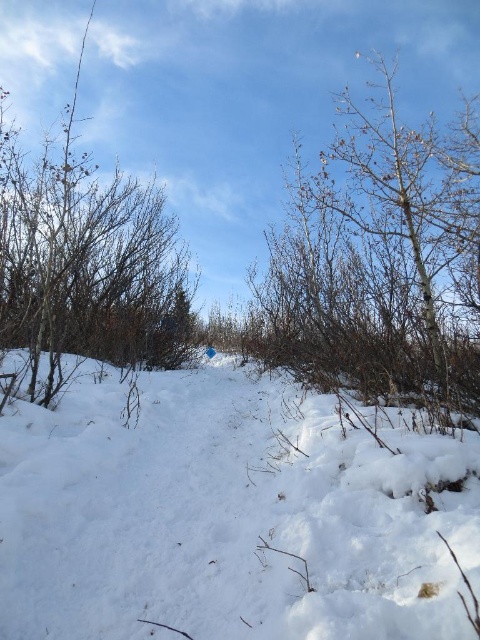
Can you confirm if white fluffy snow at center is positioned to the left of bare branches at upper right?

Indeed, white fluffy snow at center is positioned on the left side of bare branches at upper right.

Between white fluffy snow at center and bare branches at upper right, which one has more height?

Standing taller between the two is bare branches at upper right.

Who is more forward, (x=257, y=509) or (x=397, y=179)?

Point (x=257, y=509) is more forward.

This screenshot has width=480, height=640. What are the coordinates of `white fluffy snow at center` in the screenshot? It's located at (230, 513).

Which is below, bare branches at upper right or brown/dry wood at left?

brown/dry wood at left is below.

Is bare branches at upper right to the right of brown/dry wood at left from the viewer's perspective?

Correct, you'll find bare branches at upper right to the right of brown/dry wood at left.

Who is more distant from viewer, (313,336) or (61,208)?

The point (61,208) is more distant.

What are the coordinates of `bare branches at upper right` in the screenshot? It's located at (380, 260).

Can you confirm if white fluffy snow at center is smaller than brown/dry wood at left?

Yes.

Which of these two, white fluffy snow at center or brown/dry wood at left, stands shorter?

With less height is white fluffy snow at center.

Image resolution: width=480 pixels, height=640 pixels. Identify the location of white fluffy snow at center. (230, 513).